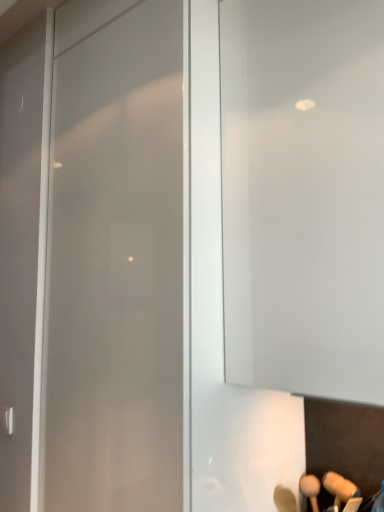
This screenshot has height=512, width=384. What do you see at coordinates (6, 419) in the screenshot?
I see `satin silver handle at lower left` at bounding box center [6, 419].

Locate an element on the screen. The height and width of the screenshot is (512, 384). satin silver handle at lower left is located at coordinates (6, 419).

Consider the image. Measure the distance between satin silver handle at lower left and camera.

satin silver handle at lower left is 1.39 meters away from camera.

Measure the distance between point (153, 92) and camera.

3.65 feet.

Identify the location of transparent glass door at center. The height and width of the screenshot is (512, 384). (115, 260).

The width and height of the screenshot is (384, 512). Describe the element at coordinates (115, 260) in the screenshot. I see `transparent glass door at center` at that location.

Find the location of a particular element. Image resolution: width=384 pixels, height=512 pixels. satin silver handle at lower left is located at coordinates (6, 419).

Considering the positions of objects transparent glass door at center and satin silver handle at lower left in the image provided, who is more to the right, transparent glass door at center or satin silver handle at lower left?

Positioned to the right is transparent glass door at center.

Does transparent glass door at center lie behind satin silver handle at lower left?

No, it is in front of satin silver handle at lower left.

Does point (57, 406) appear closer or farther from the camera than point (1, 408)?

Point (57, 406) is positioned closer to the camera compared to point (1, 408).

From the image's perspective, is transparent glass door at center located above or below satin silver handle at lower left?

transparent glass door at center is situated higher than satin silver handle at lower left in the image.

From a real-world perspective, does transparent glass door at center sit lower than satin silver handle at lower left?

No, from a real-world perspective, transparent glass door at center is not beneath satin silver handle at lower left.

Can you confirm if transparent glass door at center is wider than satin silver handle at lower left?

Correct, the width of transparent glass door at center exceeds that of satin silver handle at lower left.

Can you confirm if transparent glass door at center is taller than satin silver handle at lower left?

Indeed, transparent glass door at center has a greater height compared to satin silver handle at lower left.

Is transparent glass door at center smaller than satin silver handle at lower left?

Incorrect, transparent glass door at center is not smaller in size than satin silver handle at lower left.

Is satin silver handle at lower left a part of transparent glass door at center?

That's incorrect, satin silver handle at lower left is not inside transparent glass door at center.

Is transparent glass door at center in contact with satin silver handle at lower left?

transparent glass door at center and satin silver handle at lower left are not in contact.

Is transparent glass door at center facing towards satin silver handle at lower left?

No, transparent glass door at center is not facing towards satin silver handle at lower left.

What's the angular difference between transparent glass door at center and satin silver handle at lower left's facing directions?

transparent glass door at center and satin silver handle at lower left are facing 0.213 degrees away from each other.

How much distance is there between transparent glass door at center and satin silver handle at lower left?

transparent glass door at center and satin silver handle at lower left are 27.82 inches apart.

Image resolution: width=384 pixels, height=512 pixels. Identify the location of door handle that appears below the transparent glass door at center (from the image's perspective). (6, 419).

Which object is positioned more to the right, satin silver handle at lower left or transparent glass door at center?

transparent glass door at center.

Based on the photo, does satin silver handle at lower left come in front of transparent glass door at center?

No, satin silver handle at lower left is further to the viewer.

Considering the points (4, 422) and (87, 58), which point is behind, point (4, 422) or point (87, 58)?

The point (4, 422) is farther.

From the image's perspective, between satin silver handle at lower left and transparent glass door at center, who is located below?

satin silver handle at lower left is shown below in the image.

From a real-world perspective, is satin silver handle at lower left physically located above or below transparent glass door at center?

In terms of real-world spatial position, satin silver handle at lower left is below transparent glass door at center.

Considering the sizes of satin silver handle at lower left and transparent glass door at center in the image, is satin silver handle at lower left wider or thinner than transparent glass door at center?

In the image, satin silver handle at lower left appears to be more narrow than transparent glass door at center.

Is satin silver handle at lower left taller or shorter than transparent glass door at center?

satin silver handle at lower left is shorter than transparent glass door at center.

Considering the relative sizes of satin silver handle at lower left and transparent glass door at center in the image provided, is satin silver handle at lower left smaller than transparent glass door at center?

Yes, satin silver handle at lower left is smaller than transparent glass door at center.

Is satin silver handle at lower left positioned beyond the bounds of transparent glass door at center?

satin silver handle at lower left is positioned outside transparent glass door at center.

Is satin silver handle at lower left next to transparent glass door at center?

No, satin silver handle at lower left is not in contact with transparent glass door at center.

Is satin silver handle at lower left looking in the opposite direction of transparent glass door at center?

No.

How many degrees apart are the facing directions of satin silver handle at lower left and transparent glass door at center?

They differ by 0.213 degrees in their facing directions.

Where is `door handle on the left of transparent glass door at center`? The width and height of the screenshot is (384, 512). door handle on the left of transparent glass door at center is located at coordinates (6, 419).

You are a GUI agent. You are given a task and a screenshot of the screen. Output one action in this format:
    pyautogui.click(x=<x>, y=<y>)
    Task: Click on the door handle located on the left of transparent glass door at center
    This screenshot has height=512, width=384.
    Given the screenshot: What is the action you would take?
    pyautogui.click(x=6, y=419)

This screenshot has width=384, height=512. I want to click on glass door above the satin silver handle at lower left (from a real-world perspective), so click(115, 260).